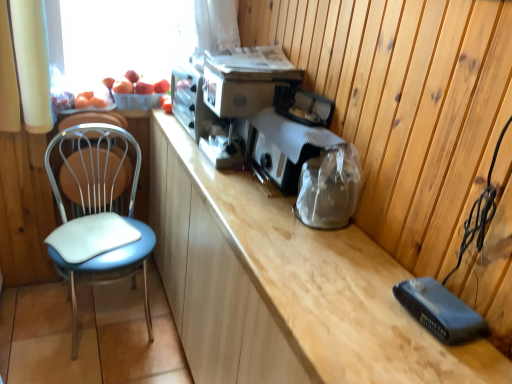
Question: From a real-world perspective, is wooden cabinet at center above or below matte black toaster at center, which is counted as the first appliance, starting from the front?

Choices:
 (A) above
 (B) below

Answer: (B)

Question: Choose the correct answer: Is wooden cabinet at center inside matte black toaster at center, which is counted as the first appliance, starting from the front, or outside it?

Choices:
 (A) inside
 (B) outside

Answer: (B)

Question: Estimate the real-world distances between objects in this image. Which object is closer to the metallic silver toaster at center, the second appliance positioned from the front?

Choices:
 (A) translucent plastic basket at upper left
 (B) matte black toaster at center, the 2th appliance in the back-to-front sequence
 (C) blue leatherette chair at left
 (D) white leather swivel chair at left
 (E) wooden cabinet at center

Answer: (B)

Question: Which is farther from the matte black toaster at center, the 2th appliance in the back-to-front sequence?

Choices:
 (A) wooden cabinet at center
 (B) translucent plastic basket at upper left
 (C) blue leatherette chair at left
 (D) white leather swivel chair at left
 (E) metallic silver toaster at center, which is counted as the first appliance, starting from the back

Answer: (D)